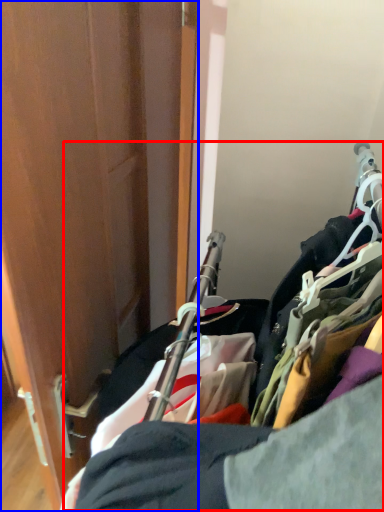
Question: Which object is closer to the camera taking this photo, closet (highlighted by a red box) or door (highlighted by a blue box)?

Choices:
 (A) closet
 (B) door

Answer: (A)